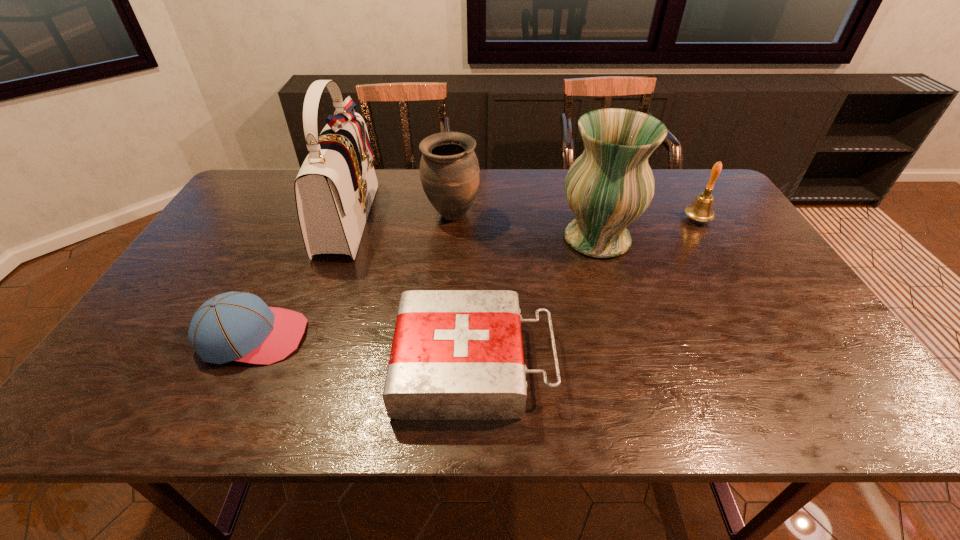
What are the coordinates of `satchel` in the screenshot? It's located at (334, 190).

Identify the location of the second object from right to left. The image size is (960, 540). (609, 186).

At what (x,y) coordinates should I click in order to perform the action: click on vase. Please return your answer as a coordinate pair (x, y). The width and height of the screenshot is (960, 540). Looking at the image, I should click on coord(609,186).

Locate an element on the screen. The height and width of the screenshot is (540, 960). urn is located at coordinates (449, 170).

This screenshot has height=540, width=960. In order to click on bell in this screenshot , I will do `click(701, 210)`.

What are the coordinates of `the rightmost object` in the screenshot? It's located at (701, 210).

Locate an element on the screen. baseball cap is located at coordinates (235, 326).

Where is `the shortest object`? The width and height of the screenshot is (960, 540). the shortest object is located at coordinates (456, 354).

I want to click on vacant space located on the front-facing side of the satchel, so click(405, 218).

Locate an element on the screen. The image size is (960, 540). vacant space located on the left of the fifth shortest object is located at coordinates (426, 239).